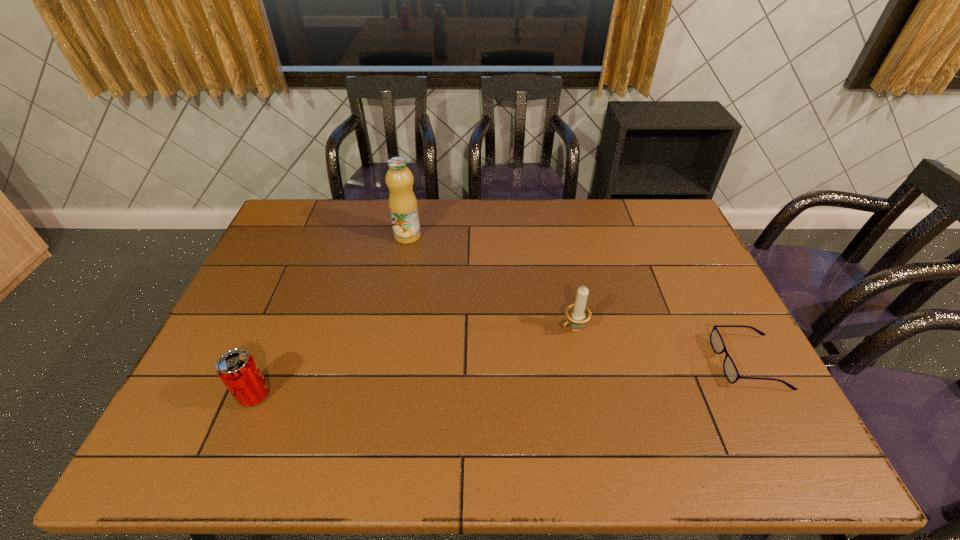
Identify the location of vacant space on the desktop that is between the soda can and the shortest object and is positioned on the front label of the farthest object. (577, 374).

The width and height of the screenshot is (960, 540). Find the location of `vacant space on the desktop that is between the soda can and the spectacles and is positioned on the handle side of the second object from right to left`. vacant space on the desktop that is between the soda can and the spectacles and is positioned on the handle side of the second object from right to left is located at coordinates (501, 379).